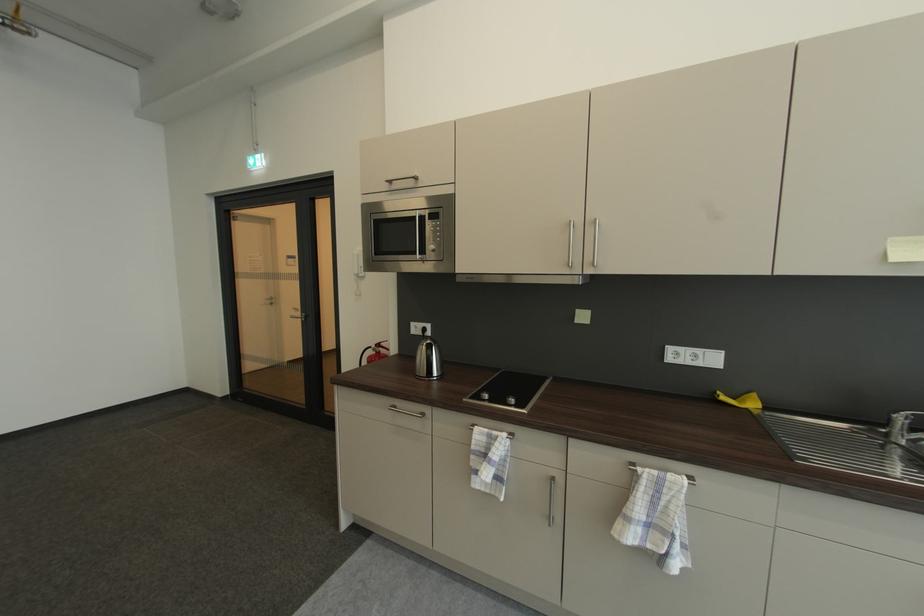
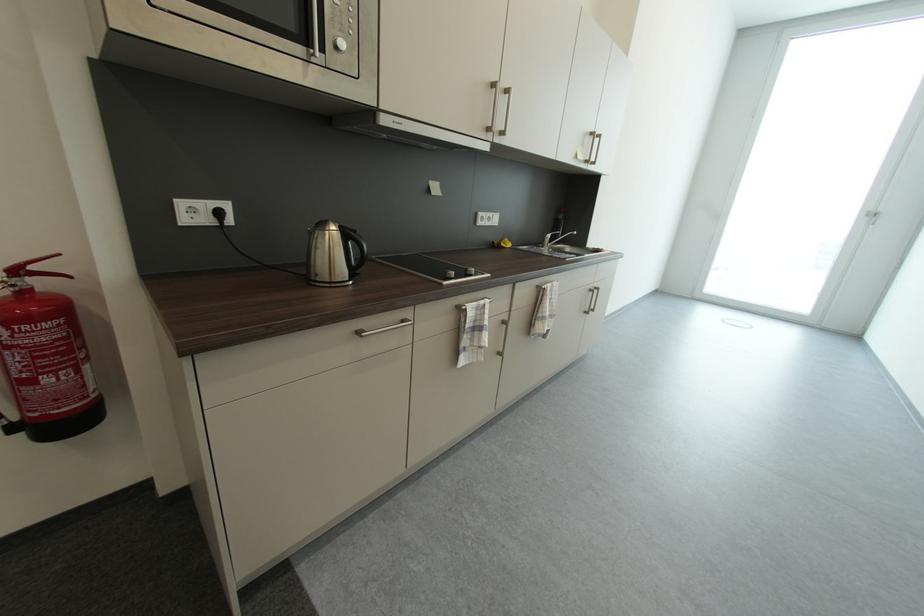
Find the pixel in the second image that matches (x=896, y=422) in the first image.

(550, 241)